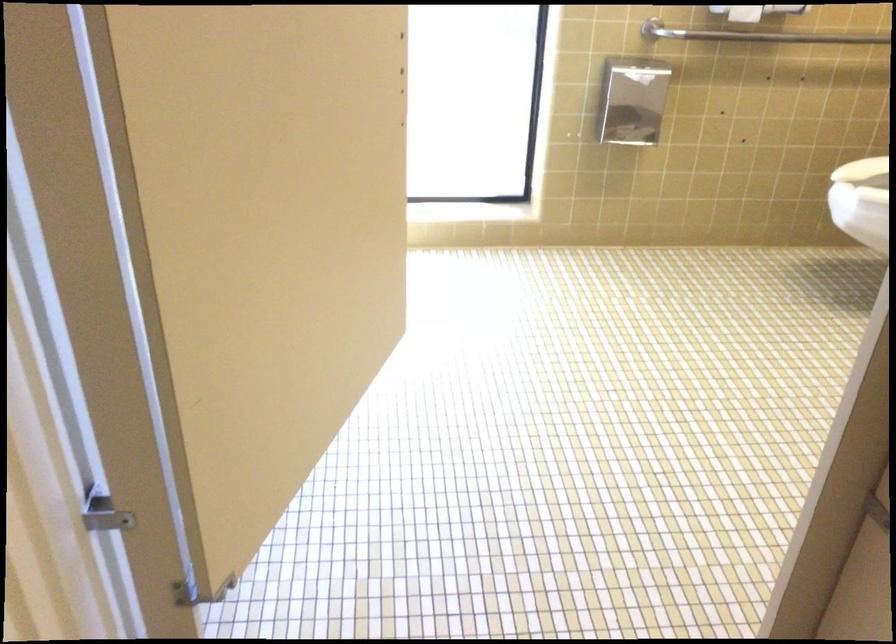
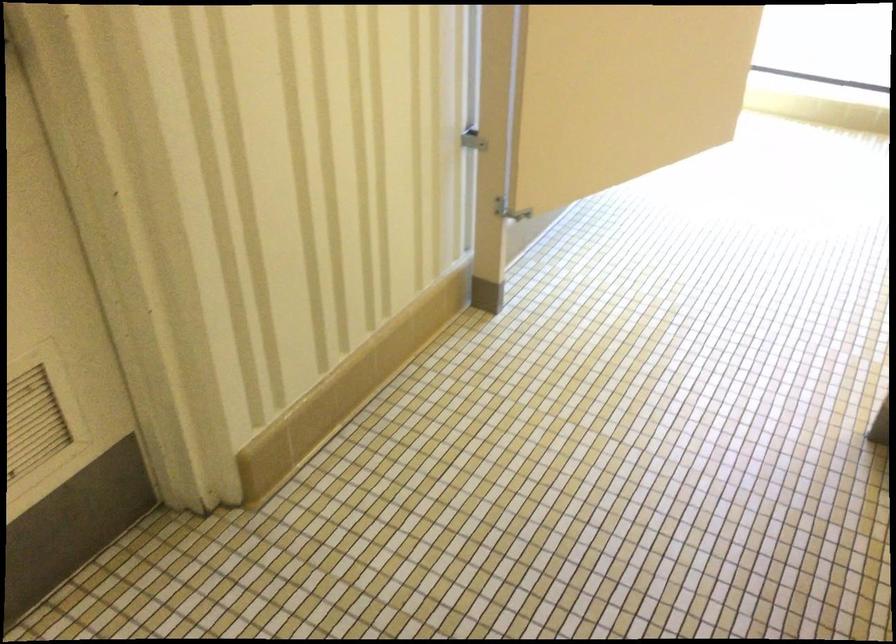
Find the pixel in the second image that matches pixel 305 359 in the first image.

(623, 91)